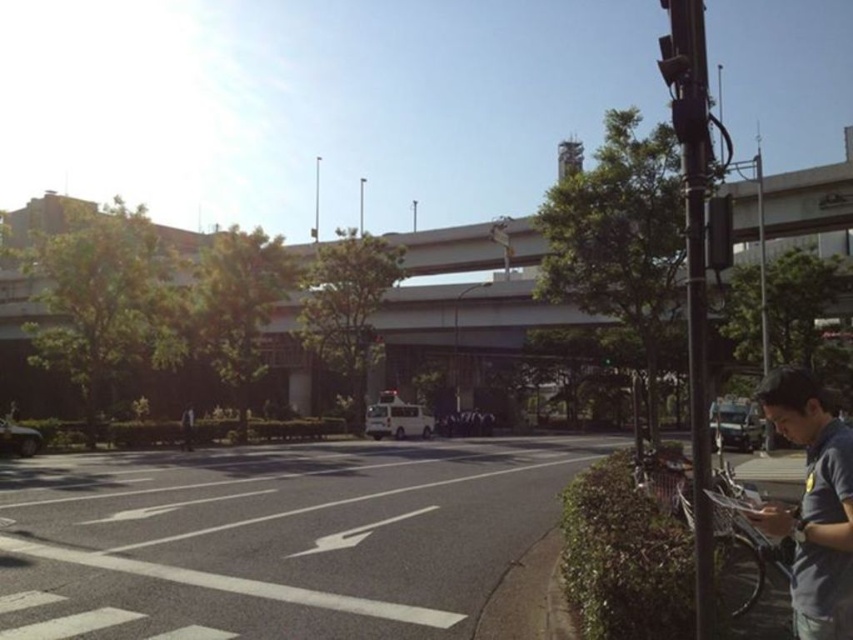
Question: Can you confirm if white asphalt road at center is wider than dark gray shirt at center?

Choices:
 (A) yes
 (B) no

Answer: (A)

Question: Does gray cotton shirt at lower right have a greater width compared to dark gray shirt at center?

Choices:
 (A) no
 (B) yes

Answer: (A)

Question: Which of the following is the closest to the observer?

Choices:
 (A) dark gray shirt at center
 (B) white asphalt road at center
 (C) gray cotton shirt at lower right

Answer: (C)

Question: Which point appears closest to the camera in this image?

Choices:
 (A) (183, 413)
 (B) (838, 516)

Answer: (B)

Question: Is gray cotton shirt at lower right smaller than dark gray shirt at center?

Choices:
 (A) no
 (B) yes

Answer: (B)

Question: Which of the following is the closest to the observer?

Choices:
 (A) dark gray shirt at center
 (B) white asphalt road at center
 (C) gray cotton shirt at lower right

Answer: (C)